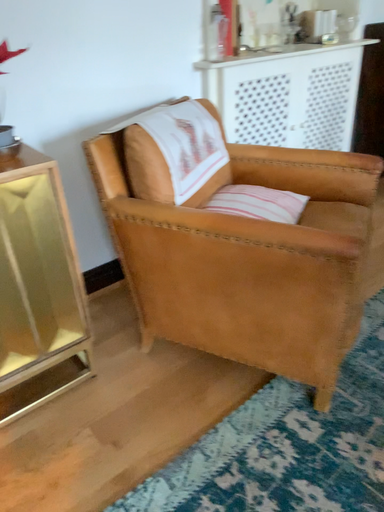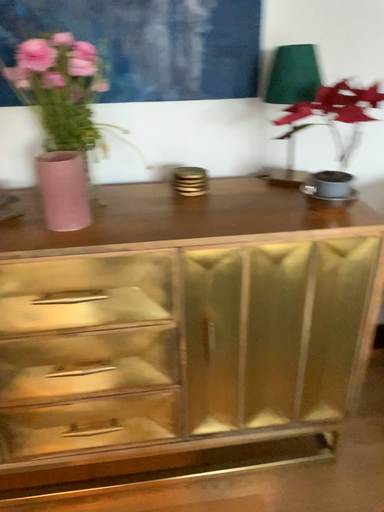
Question: How did the camera likely rotate when shooting the video?

Choices:
 (A) rotated downward
 (B) rotated upward

Answer: (B)